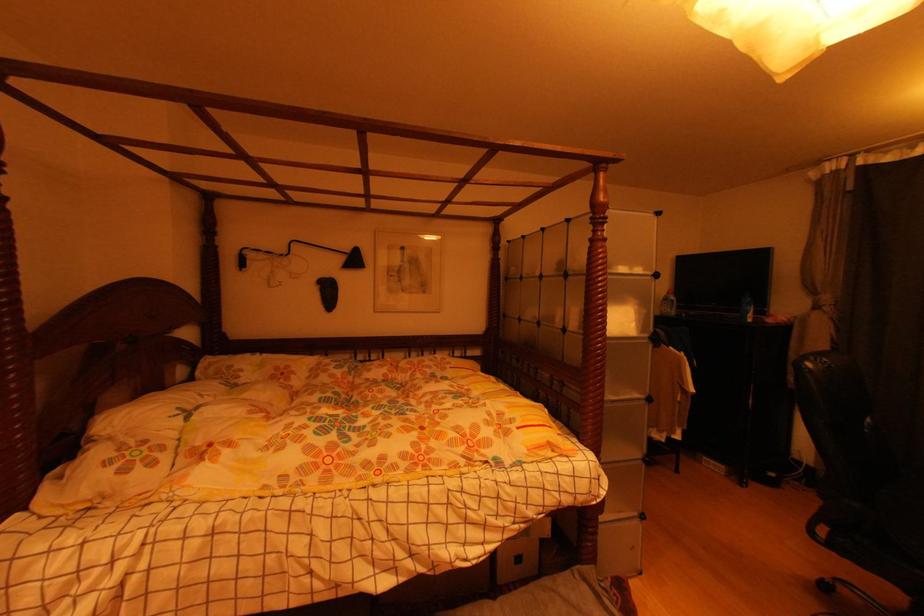
The location [747,307] corresponds to which object?

This point indicates the white detergent bottle.